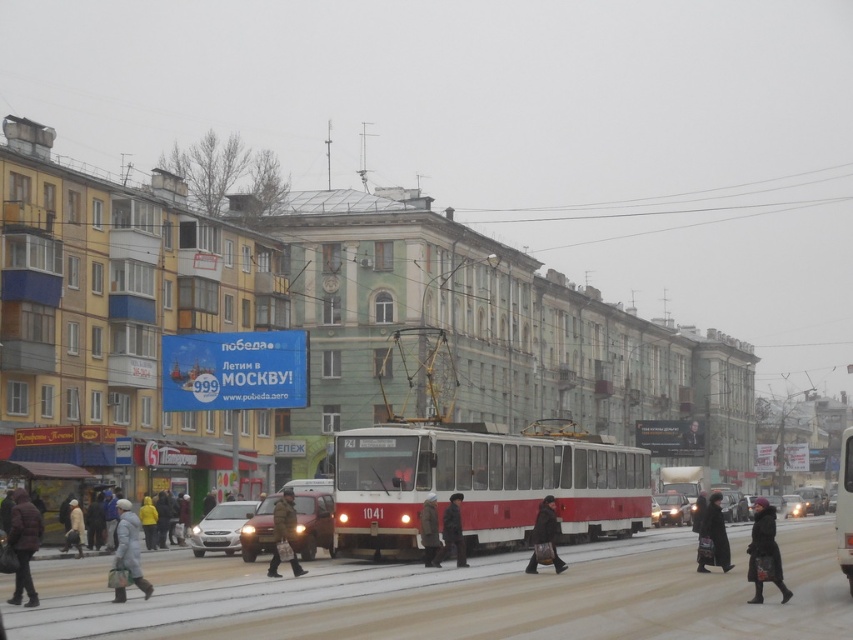
Question: Which point appears closest to the camera in this image?

Choices:
 (A) (674, 515)
 (B) (97, 548)

Answer: (B)

Question: Can you confirm if matte red car at center is smaller than light gray fabric coat at lower left?

Choices:
 (A) yes
 (B) no

Answer: (A)

Question: From the image, what is the correct spatial relationship of dark gray wool coat at lower left in relation to metallic silver car at center?

Choices:
 (A) below
 (B) above

Answer: (B)

Question: Which point is farther from the camera taking this photo?

Choices:
 (A) (538, 540)
 (B) (297, 573)
 (C) (312, 509)
 (D) (451, 534)

Answer: (C)

Question: Which of the following is the closest to the observer?

Choices:
 (A) shiny silver car at center
 (B) light gray fabric coat at lower left

Answer: (B)

Question: Considering the relative positions of dark gray wool coat at lower right and camouflage jacket at center in the image provided, where is dark gray wool coat at lower right located with respect to camouflage jacket at center?

Choices:
 (A) below
 (B) above

Answer: (A)